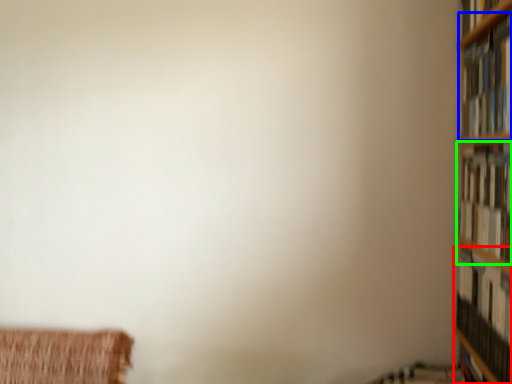
Question: Which is nearer to the book (highlighted by a red box)? book (highlighted by a blue box) or book (highlighted by a green box).

Choices:
 (A) book
 (B) book

Answer: (B)